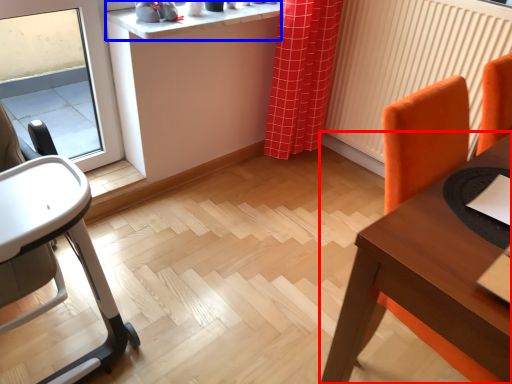
Question: Which point is closer to the camera, table (highlighted by a red box) or counter top (highlighted by a blue box)?

Choices:
 (A) table
 (B) counter top

Answer: (A)